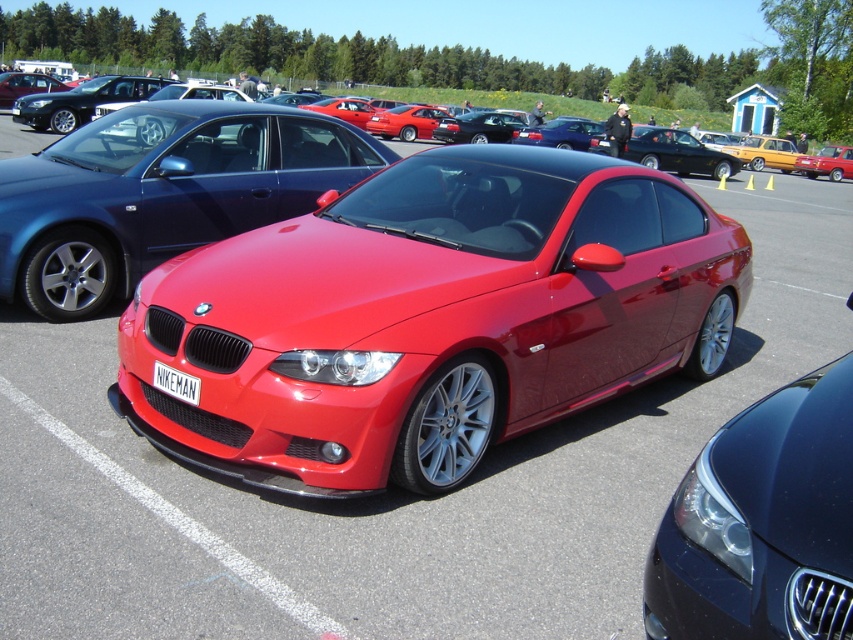
Question: Which object is the farthest from the metallic red car at center?

Choices:
 (A) matte black car at upper left
 (B) shiny metallic car at center
 (C) glossy metallic sedan at center
 (D) white plastic license plate at center

Answer: (D)

Question: Does metallic red car at center appear under matte black car at upper left?

Choices:
 (A) no
 (B) yes

Answer: (B)

Question: Among these objects, which one is farthest from the camera?

Choices:
 (A) shiny metallic car at center
 (B) glossy metallic sedan at center
 (C) metallic red car at center

Answer: (C)

Question: Estimate the real-world distances between objects in this image. Which object is farther from the glossy metallic sedan at center?

Choices:
 (A) metallic red car at center
 (B) white plastic license plate at center

Answer: (A)

Question: In this image, where is shiny metallic car at center located relative to metallic red car at center?

Choices:
 (A) right
 (B) left

Answer: (B)

Question: Does matte black car at upper left come behind white plastic license plate at center?

Choices:
 (A) yes
 (B) no

Answer: (A)